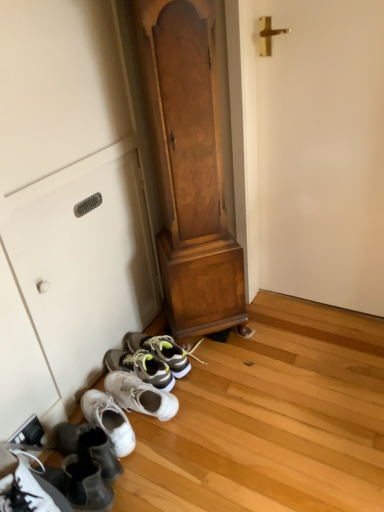
Question: Is white matte cabinet at lower left smaller than white matte door at right?

Choices:
 (A) no
 (B) yes

Answer: (B)

Question: From a real-world perspective, is white matte cabinet at lower left physically above white matte door at right?

Choices:
 (A) yes
 (B) no

Answer: (B)

Question: Considering the relative sizes of white matte cabinet at lower left and white matte door at right in the image provided, is white matte cabinet at lower left taller than white matte door at right?

Choices:
 (A) yes
 (B) no

Answer: (B)

Question: Is white matte cabinet at lower left positioned before white matte door at right?

Choices:
 (A) yes
 (B) no

Answer: (B)

Question: Does white matte cabinet at lower left appear on the left side of white matte door at right?

Choices:
 (A) no
 (B) yes

Answer: (B)

Question: Can you confirm if white matte cabinet at lower left is wider than white matte door at right?

Choices:
 (A) yes
 (B) no

Answer: (B)

Question: Is white matte cabinet at lower left to the right of white suede shoes at lower left from the viewer's perspective?

Choices:
 (A) no
 (B) yes

Answer: (B)

Question: Would you consider white matte cabinet at lower left to be distant from white suede shoes at lower left?

Choices:
 (A) no
 (B) yes

Answer: (A)

Question: Is white matte cabinet at lower left bigger than white suede shoes at lower left?

Choices:
 (A) yes
 (B) no

Answer: (A)

Question: Can you confirm if white matte cabinet at lower left is thinner than white suede shoes at lower left?

Choices:
 (A) no
 (B) yes

Answer: (B)

Question: From the image's perspective, is white matte cabinet at lower left located beneath white suede shoes at lower left?

Choices:
 (A) yes
 (B) no

Answer: (B)

Question: Could white suede shoes at lower left be considered to be inside white matte cabinet at lower left?

Choices:
 (A) yes
 (B) no

Answer: (B)

Question: Can you confirm if white matte door at right is bigger than wooden dresser at center?

Choices:
 (A) no
 (B) yes

Answer: (A)